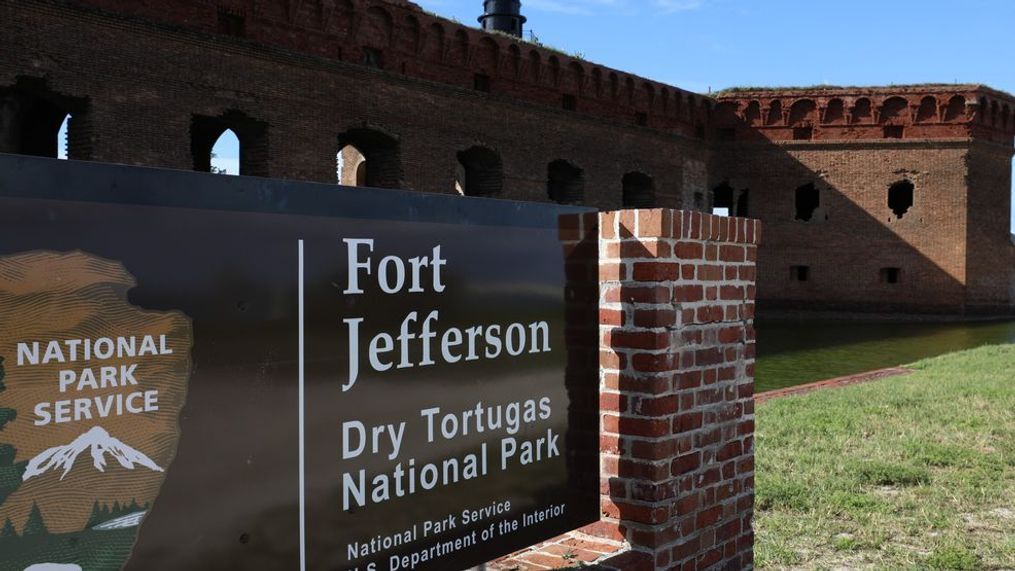
You are a GUI agent. You are given a task and a screenshot of the screen. Output one action in this format:
    pyautogui.click(x=<x>, y=<y>)
    Task: Click on the chimney
    
    Given the screenshot: What is the action you would take?
    pyautogui.click(x=498, y=11)